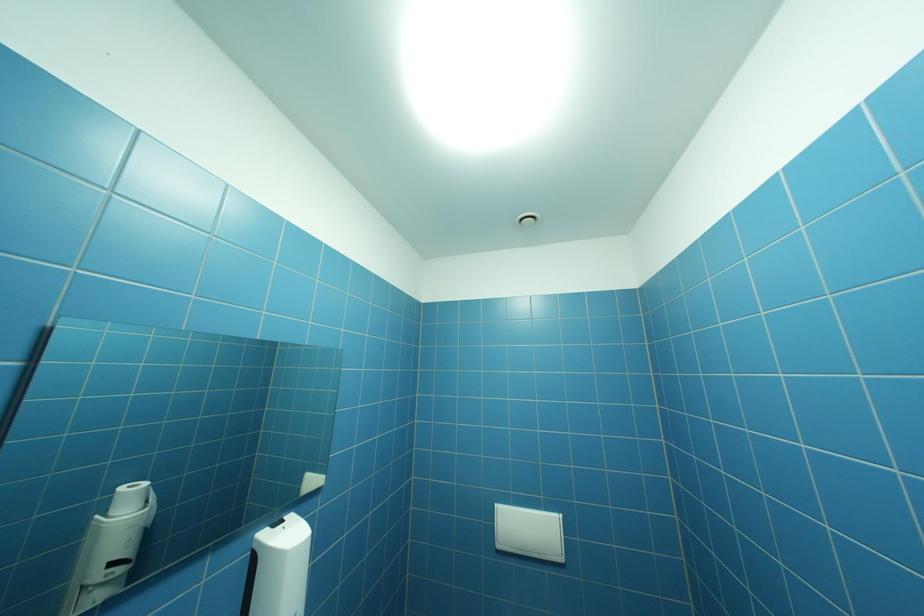
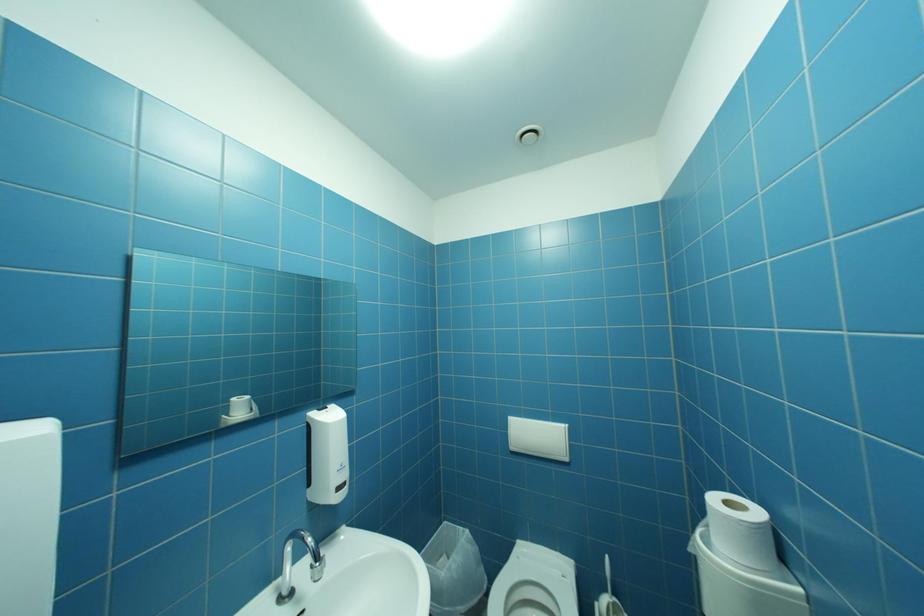
Question: The images are taken continuously from a first-person perspective. In which direction are you moving?

Choices:
 (A) Left
 (B) Right
 (C) Forward
 (D) Backward

Answer: (B)